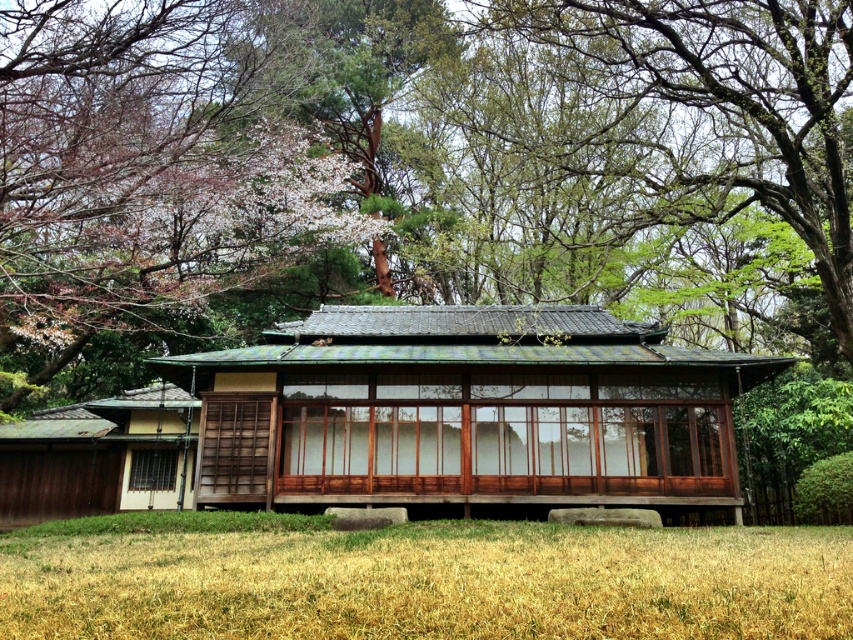
Question: Among these objects, which one is farthest from the camera?

Choices:
 (A) green leafy tree at upper center
 (B) wooden gazebo at center

Answer: (B)

Question: Can you confirm if wooden gazebo at center is positioned to the right of dry grass at lower center?

Choices:
 (A) yes
 (B) no

Answer: (A)

Question: Which of the following is the closest to the observer?

Choices:
 (A) (810, 328)
 (B) (279, 554)
 (C) (590, 321)

Answer: (B)

Question: Does wooden gazebo at center have a lesser width compared to dry grass at lower center?

Choices:
 (A) yes
 (B) no

Answer: (A)

Question: Which of the following is the closest to the observer?

Choices:
 (A) wooden gazebo at center
 (B) dry grass at lower center

Answer: (B)

Question: Can you confirm if wooden gazebo at center is positioned below dry grass at lower center?

Choices:
 (A) no
 (B) yes

Answer: (A)